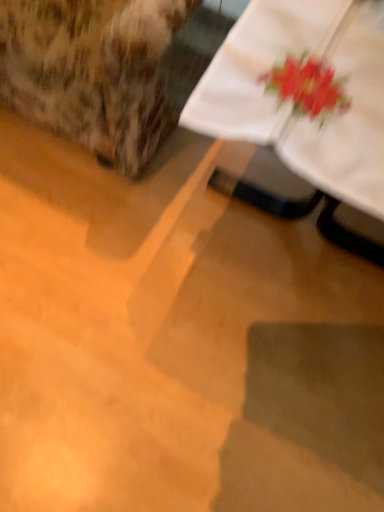
The height and width of the screenshot is (512, 384). What do you see at coordinates (92, 71) in the screenshot? I see `floral fabric armchair at upper left` at bounding box center [92, 71].

The height and width of the screenshot is (512, 384). I want to click on floral fabric armchair at upper left, so click(92, 71).

What do you see at coordinates (291, 98) in the screenshot?
I see `white cloth at upper right` at bounding box center [291, 98].

Locate an element on the screen. The image size is (384, 512). white cloth at upper right is located at coordinates (291, 98).

In the scene shown: Measure the distance between white cloth at upper right and camera.

They are 52.10 centimeters apart.

The width and height of the screenshot is (384, 512). Find the location of `floral fabric armchair at upper left`. floral fabric armchair at upper left is located at coordinates (92, 71).

Considering the positions of objects floral fabric armchair at upper left and white cloth at upper right in the image provided, who is more to the right, floral fabric armchair at upper left or white cloth at upper right?

white cloth at upper right is more to the right.

Is the depth of floral fabric armchair at upper left greater than that of white cloth at upper right?

Yes, it is behind white cloth at upper right.

Which is in front, point (180, 5) or point (315, 3)?

Point (315, 3)

From the image's perspective, is floral fabric armchair at upper left located beneath white cloth at upper right?

Actually, floral fabric armchair at upper left appears above white cloth at upper right in the image.

From a real-world perspective, relative to white cloth at upper right, is floral fabric armchair at upper left vertically above or below?

From a real-world perspective, floral fabric armchair at upper left is physically above white cloth at upper right.

Considering the sizes of objects floral fabric armchair at upper left and white cloth at upper right in the image provided, who is thinner, floral fabric armchair at upper left or white cloth at upper right?

floral fabric armchair at upper left is thinner.

Can you confirm if floral fabric armchair at upper left is taller than white cloth at upper right?

Correct, floral fabric armchair at upper left is much taller as white cloth at upper right.

Does floral fabric armchair at upper left have a smaller size compared to white cloth at upper right?

Incorrect, floral fabric armchair at upper left is not smaller in size than white cloth at upper right.

Is floral fabric armchair at upper left not within white cloth at upper right?

Absolutely, floral fabric armchair at upper left is external to white cloth at upper right.

Are floral fabric armchair at upper left and white cloth at upper right beside each other?

No, floral fabric armchair at upper left is not making contact with white cloth at upper right.

Does floral fabric armchair at upper left turn towards white cloth at upper right?

No, floral fabric armchair at upper left is not oriented towards white cloth at upper right.

Measure the distance between floral fabric armchair at upper left and white cloth at upper right.

They are 12.57 inches apart.

Locate an element on the screen. armchair behind the white cloth at upper right is located at coordinates (92, 71).

Does white cloth at upper right appear on the left side of floral fabric armchair at upper left?

Incorrect, white cloth at upper right is not on the left side of floral fabric armchair at upper left.

Based on the photo, does white cloth at upper right come behind floral fabric armchair at upper left?

No, the depth of white cloth at upper right is less than that of floral fabric armchair at upper left.

Is point (250, 22) in front of point (68, 9)?

Yes, it is.

From the image's perspective, between white cloth at upper right and floral fabric armchair at upper left, who is located below?

From the image's view, white cloth at upper right is below.

From a real-world perspective, is white cloth at upper right physically located above or below floral fabric armchair at upper left?

white cloth at upper right is situated lower than floral fabric armchair at upper left in the real world.

Considering the sizes of objects white cloth at upper right and floral fabric armchair at upper left in the image provided, who is wider, white cloth at upper right or floral fabric armchair at upper left?

With larger width is white cloth at upper right.

Is white cloth at upper right taller than floral fabric armchair at upper left?

No.

Is white cloth at upper right smaller than floral fabric armchair at upper left?

Correct, white cloth at upper right occupies less space than floral fabric armchair at upper left.

Would you say floral fabric armchair at upper left is part of white cloth at upper right's contents?

Actually, floral fabric armchair at upper left is outside white cloth at upper right.

Is white cloth at upper right beside floral fabric armchair at upper left?

white cloth at upper right and floral fabric armchair at upper left are not in contact.

Could you tell me if white cloth at upper right is facing floral fabric armchair at upper left?

No.

Locate an element on the screen. This screenshot has width=384, height=512. armchair on the left of white cloth at upper right is located at coordinates (92, 71).

This screenshot has width=384, height=512. In order to click on armchair that is behind the white cloth at upper right in this screenshot , I will do `click(92, 71)`.

Identify the location of armchair on the left of the white cloth at upper right. (92, 71).